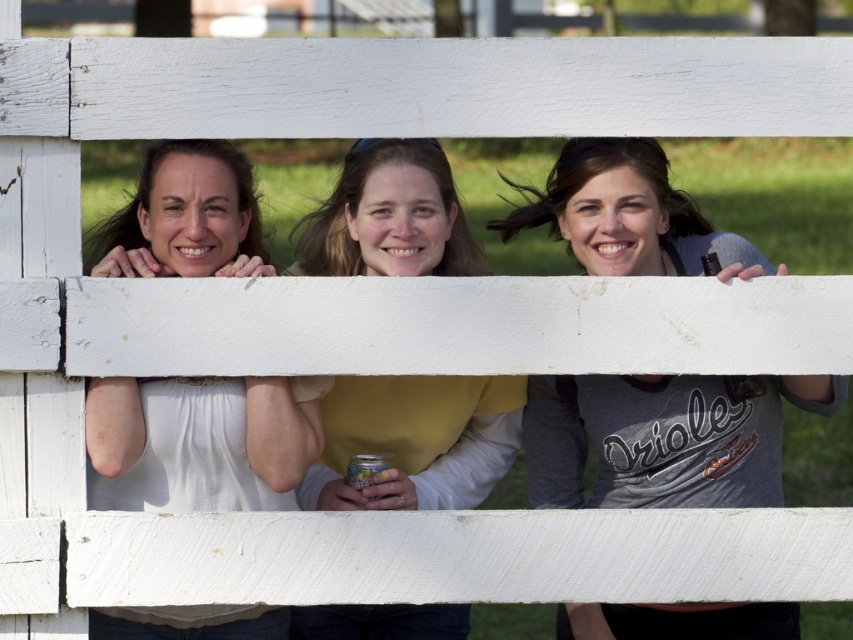
Question: Can you confirm if gray matte shirt at center is positioned to the right of white matte shirt at upper left?

Choices:
 (A) no
 (B) yes

Answer: (B)

Question: Which is nearer to the gray matte shirt at center?

Choices:
 (A) yellow matte shirt at center
 (B) white matte shirt at upper left

Answer: (A)

Question: Considering the real-world distances, which object is closest to the gray matte shirt at center?

Choices:
 (A) yellow matte shirt at center
 (B) white matte shirt at upper left

Answer: (A)

Question: Is white matte shirt at upper left to the right of yellow matte shirt at center from the viewer's perspective?

Choices:
 (A) no
 (B) yes

Answer: (A)

Question: Does gray matte shirt at center appear over white matte shirt at upper left?

Choices:
 (A) no
 (B) yes

Answer: (A)

Question: Which object is closer to the camera taking this photo?

Choices:
 (A) yellow matte shirt at center
 (B) gray matte shirt at center
 (C) white matte shirt at upper left

Answer: (C)